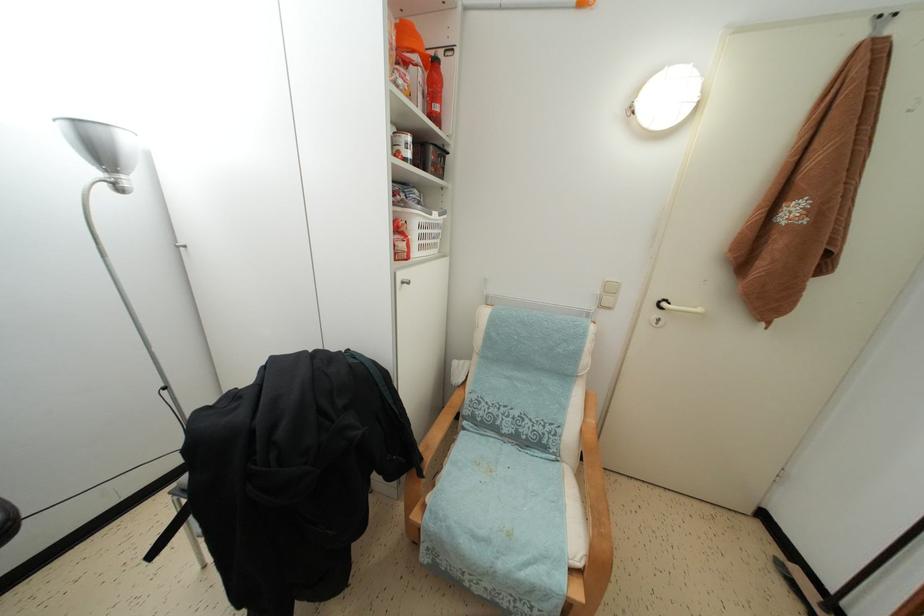
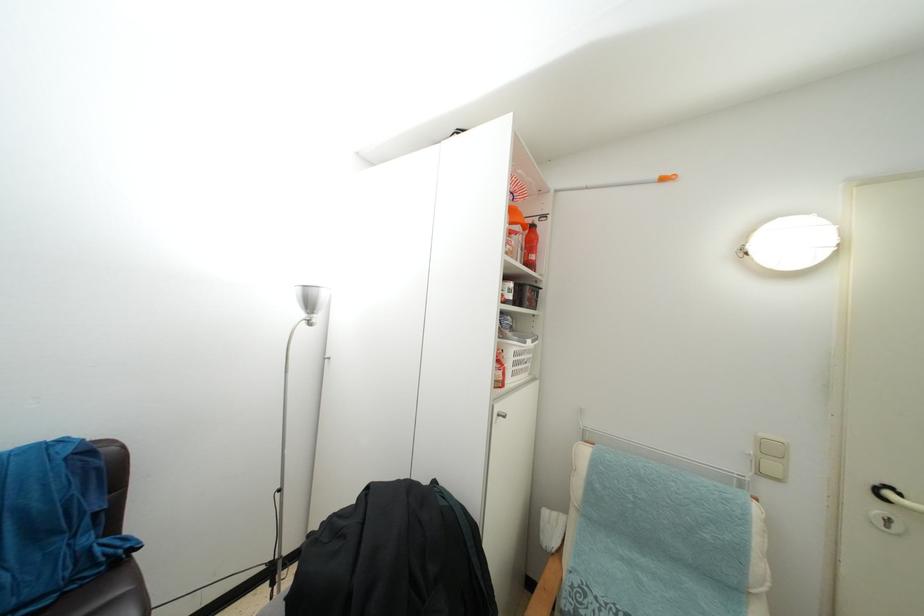
In the second image, find the point that corresponds to pixel 667 310 in the first image.

(893, 500)